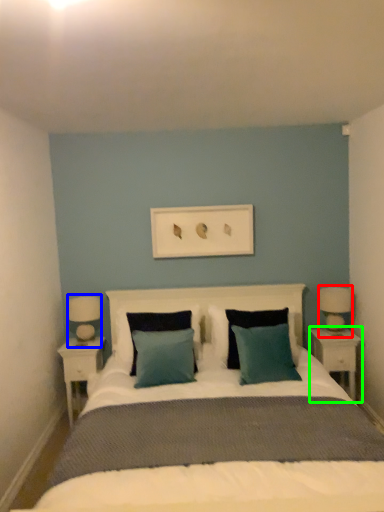
Question: Based on their relative distances, which object is nearer to bedside lamp (highlighted by a red box)? Choose from table lamp (highlighted by a blue box) and nightstand (highlighted by a green box).

Choices:
 (A) table lamp
 (B) nightstand

Answer: (B)